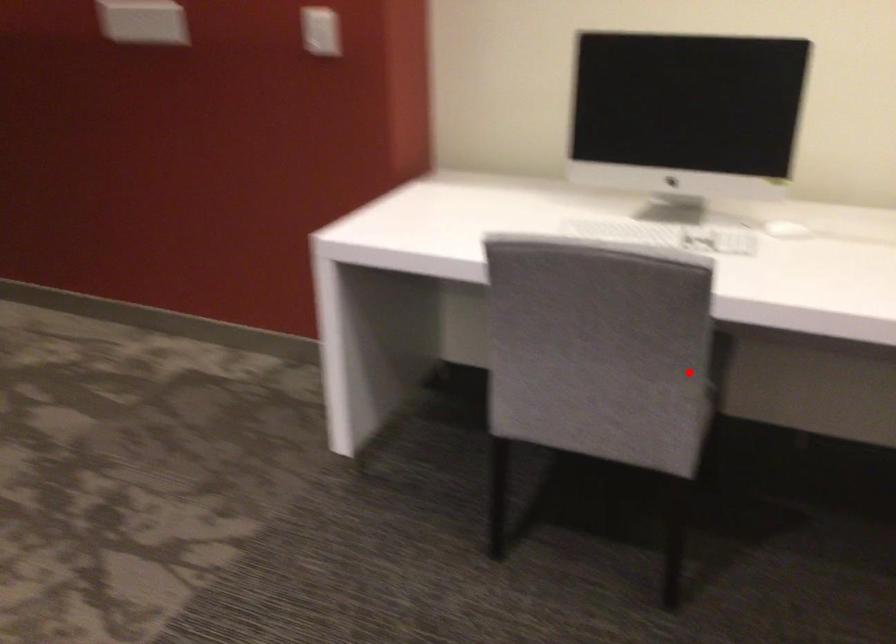
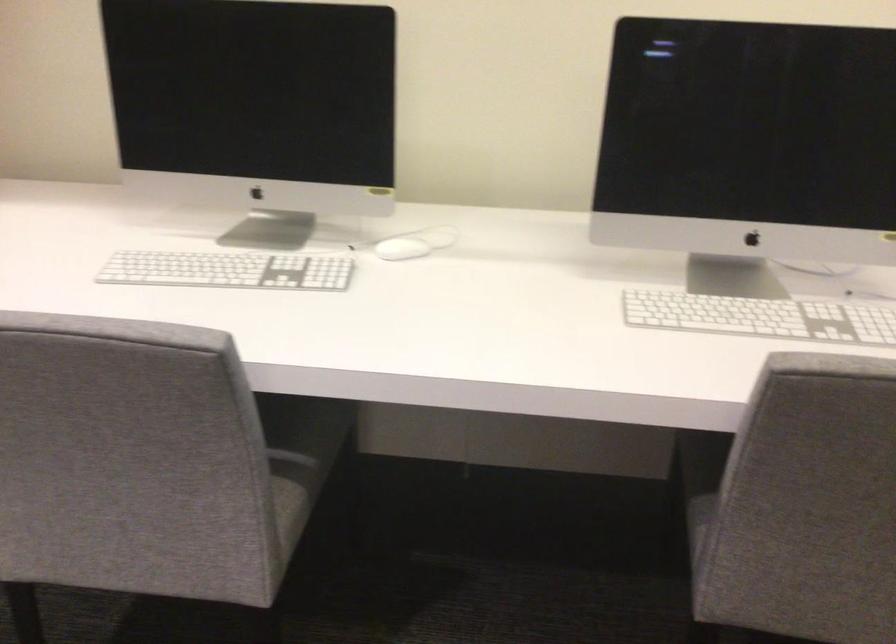
In the second image, find the point that corresponds to the highlighted location in the first image.

(291, 456)